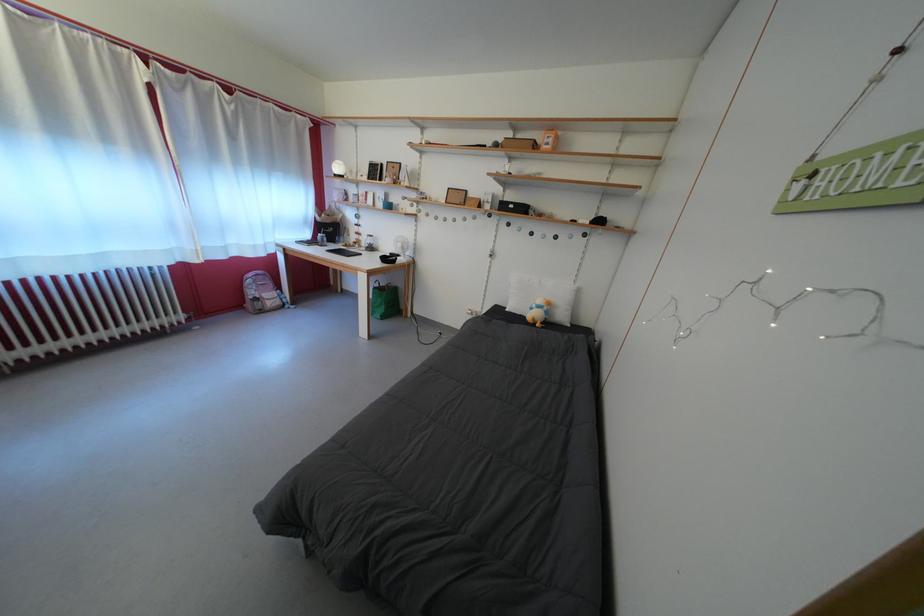
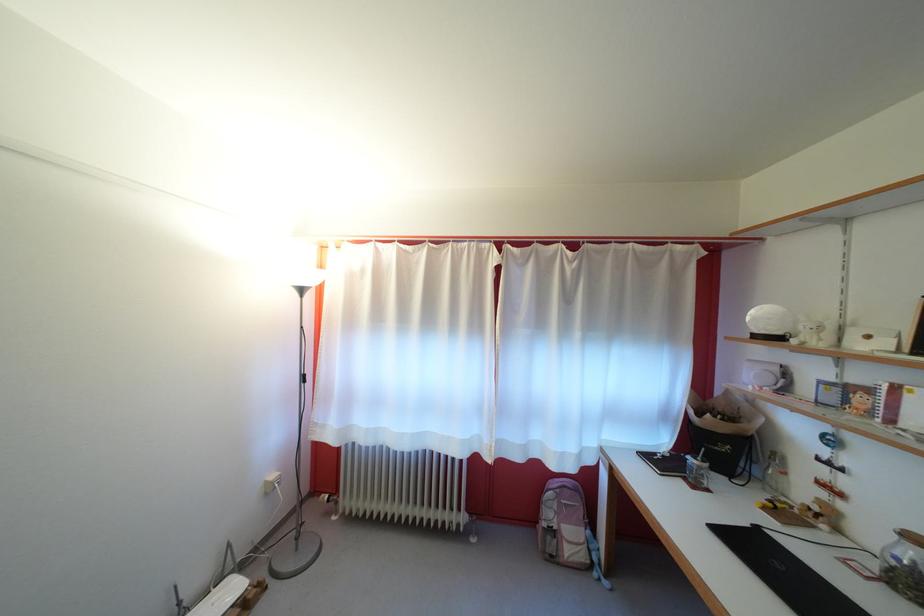
Find the pixel in the second image that matches (331,244) in the first image.

(708, 474)